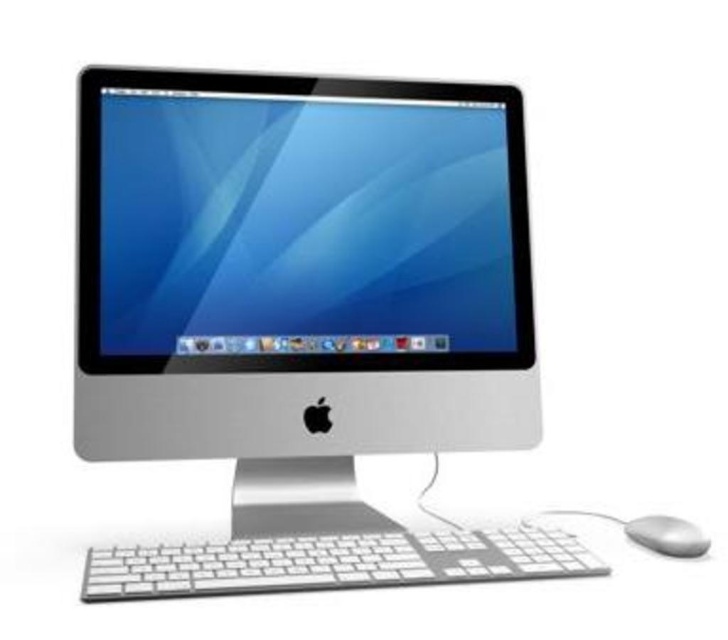
You are setting up a video call and need to position your camera so it is exactly 32 inches away from your sleek silver monitor at center. Based on the current setup, is the camera already positioned correctly?

The sleek silver monitor at center and camera are 32.21 inches apart, which is slightly more than 32 inches. Therefore, the camera is positioned a bit too far away and needs to be moved closer by 0.21 inches to meet the exact requirement.